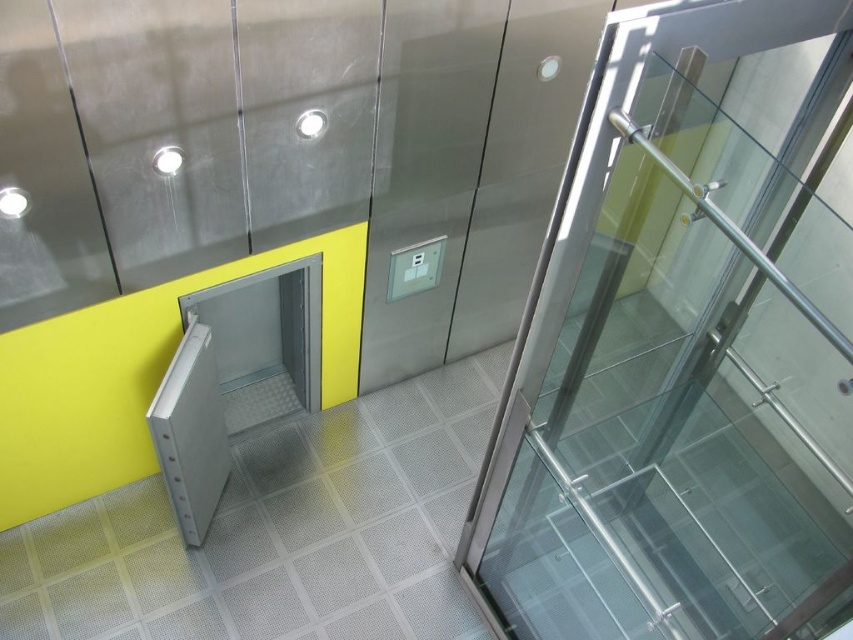
Question: Can you confirm if transparent glass door at center is positioned below white matte lift door at center?

Choices:
 (A) yes
 (B) no

Answer: (B)

Question: Which point is closer to the camera taking this photo?

Choices:
 (A) (173, 474)
 (B) (735, 28)

Answer: (B)

Question: Does transparent glass door at center appear on the left side of white matte lift door at center?

Choices:
 (A) no
 (B) yes

Answer: (A)

Question: Among these points, which one is farthest from the camera?

Choices:
 (A) (837, 474)
 (B) (201, 449)

Answer: (B)

Question: Is transparent glass door at center wider than white matte lift door at center?

Choices:
 (A) yes
 (B) no

Answer: (A)